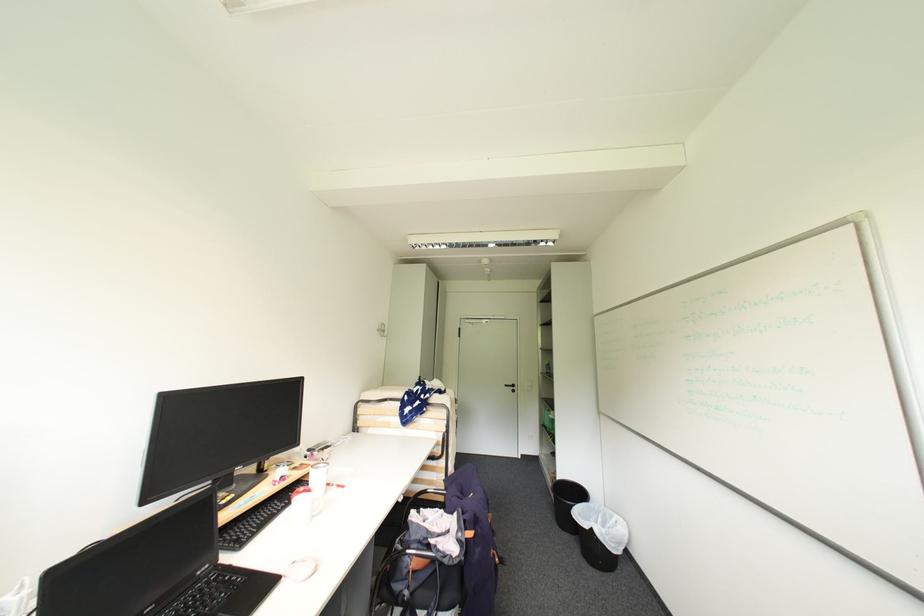
Find where to sit the chair sitting surface. Please return your answer as a coordinate pair (x, y).

(402, 517)